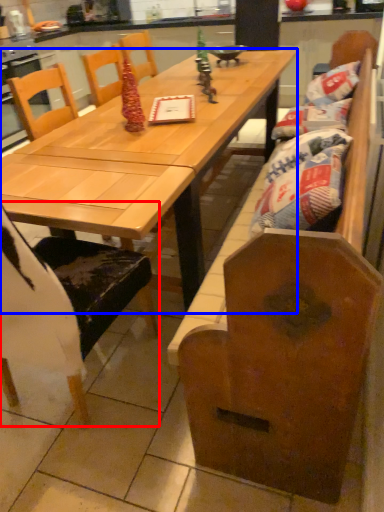
Question: Which object is further to the camera taking this photo, chair (highlighted by a red box) or table (highlighted by a blue box)?

Choices:
 (A) chair
 (B) table

Answer: (B)